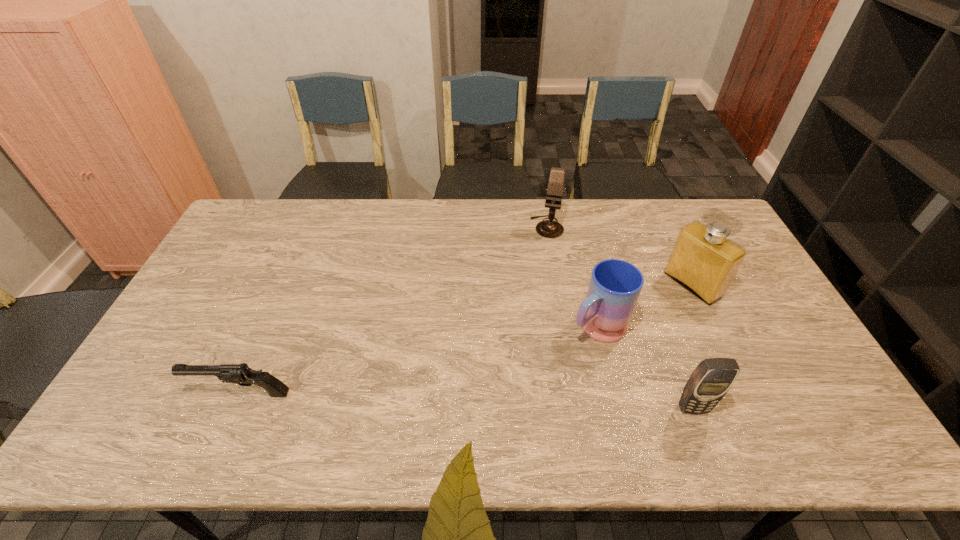
The height and width of the screenshot is (540, 960). I want to click on the second nearest object, so pos(241,374).

Where is `gun`? gun is located at coordinates (241, 374).

You are a GUI agent. You are given a task and a screenshot of the screen. Output one action in this format:
    pyautogui.click(x=<x>, y=<y>)
    Task: Click on the cellular telephone
    Image resolution: width=960 pixels, height=540 pixels.
    Given the screenshot: What is the action you would take?
    pyautogui.click(x=710, y=381)

Identify the location of the nearest object. (710, 381).

Where is `the third nearest object`? the third nearest object is located at coordinates (615, 285).

Where is `the farthest object`? This screenshot has width=960, height=540. the farthest object is located at coordinates pos(547,228).

I want to click on the second farthest object, so click(x=703, y=260).

You are a GUI agent. You are given a task and a screenshot of the screen. Output one action in this format:
    pyautogui.click(x=<x>, y=<y>)
    Task: Click on the rightmost object
    
    Given the screenshot: What is the action you would take?
    pyautogui.click(x=703, y=260)

Find the location of a particular element. This screenshot has width=960, height=540. free space located at the end of the barrel of the leftmost object is located at coordinates (150, 394).

Where is `vacant area situated 0.090m at the end of the barrel of the leftmost object`? The width and height of the screenshot is (960, 540). vacant area situated 0.090m at the end of the barrel of the leftmost object is located at coordinates (157, 394).